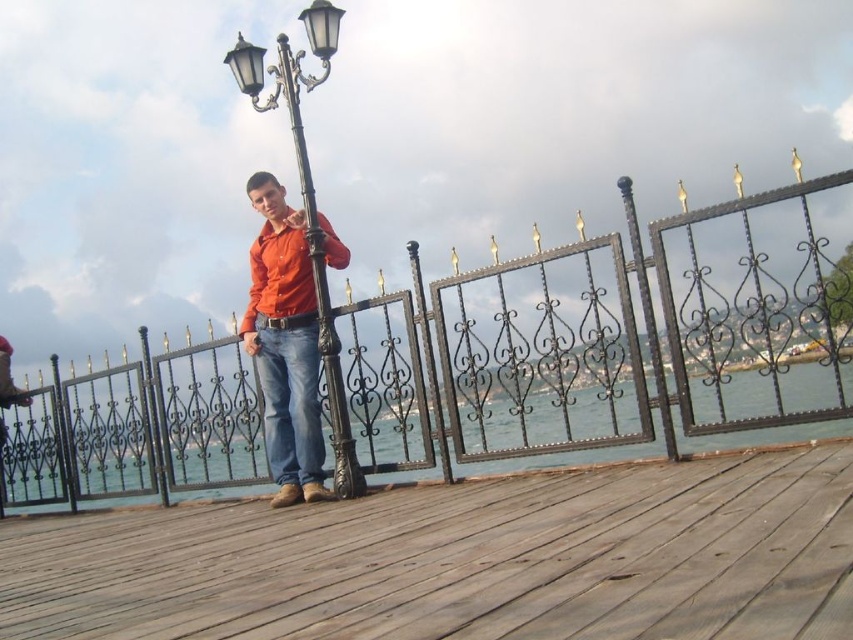
You are standing at the point marked by coordinates point (611, 337). What object are you facing?

The point (611, 337) marks the black wrought iron fence at center, so you are facing the black wrought iron fence at center.

Where is the polished metal lamp post at center located in the image?

The polished metal lamp post at center is located at point (289, 272) in the image.